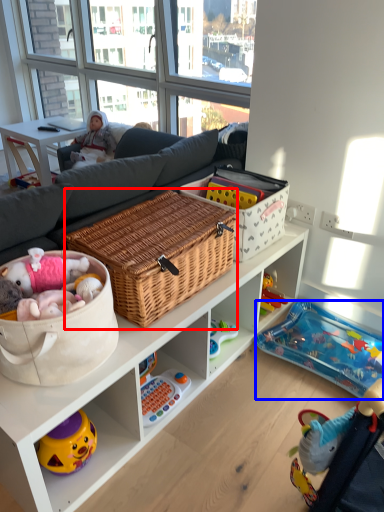
Question: Which point is closer to the camera, picnic basket (highlighted by a red box) or infant bed (highlighted by a blue box)?

Choices:
 (A) picnic basket
 (B) infant bed

Answer: (A)